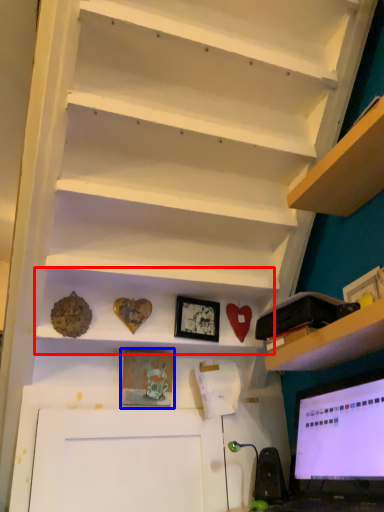
Question: Which point is closer to the camera, cabinet (highlighted by a red box) or picture frame (highlighted by a blue box)?

Choices:
 (A) cabinet
 (B) picture frame

Answer: (A)